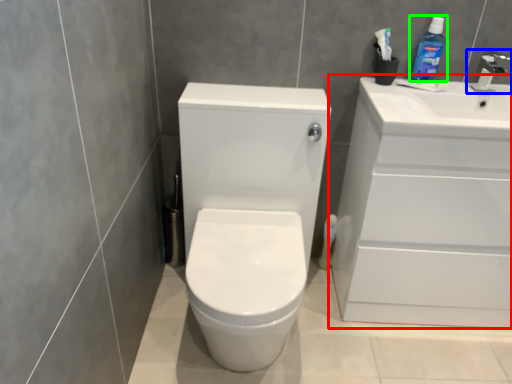
Question: Which object is the closest to the bathroom cabinet (highlighted by a red box)? Choose among these: tap (highlighted by a blue box) or cleaning product (highlighted by a green box).

Choices:
 (A) tap
 (B) cleaning product

Answer: (B)